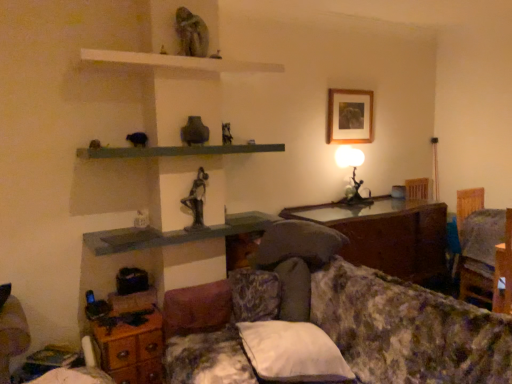
Question: From a real-world perspective, is wooden picture frame at upper center positioned over metallic silver table lamp at upper right based on gravity?

Choices:
 (A) no
 (B) yes

Answer: (B)

Question: Is wooden picture frame at upper center not within metallic silver table lamp at upper right?

Choices:
 (A) no
 (B) yes

Answer: (B)

Question: Is wooden picture frame at upper center behind metallic silver table lamp at upper right?

Choices:
 (A) no
 (B) yes

Answer: (B)

Question: Considering the relative positions of wooden picture frame at upper center and metallic silver table lamp at upper right in the image provided, is wooden picture frame at upper center to the right of metallic silver table lamp at upper right from the viewer's perspective?

Choices:
 (A) yes
 (B) no

Answer: (B)

Question: Is wooden picture frame at upper center facing away from metallic silver table lamp at upper right?

Choices:
 (A) no
 (B) yes

Answer: (A)

Question: From the image's perspective, is wooden picture frame at upper center located beneath metallic silver table lamp at upper right?

Choices:
 (A) no
 (B) yes

Answer: (A)

Question: From a real-world perspective, is green matte shelf at center, placed as the second shelf when sorted from top to bottom, on wooden dresser at lower left?

Choices:
 (A) no
 (B) yes

Answer: (B)

Question: From the image's perspective, is green matte shelf at center, placed as the second shelf when sorted from top to bottom, under wooden dresser at lower left?

Choices:
 (A) yes
 (B) no

Answer: (B)

Question: Is green matte shelf at center, acting as the second shelf starting from the bottom, further to the viewer compared to wooden dresser at lower left?

Choices:
 (A) no
 (B) yes

Answer: (A)

Question: Are green matte shelf at center, acting as the second shelf starting from the bottom, and wooden dresser at lower left beside each other?

Choices:
 (A) no
 (B) yes

Answer: (A)

Question: Is green matte shelf at center, acting as the second shelf starting from the bottom, looking in the opposite direction of wooden dresser at lower left?

Choices:
 (A) no
 (B) yes

Answer: (A)

Question: From a real-world perspective, does green matte shelf at center, acting as the second shelf starting from the bottom, sit lower than wooden dresser at lower left?

Choices:
 (A) no
 (B) yes

Answer: (A)

Question: Are bronze statue at center and matte gray shelf at center, positioned as the 1th shelf in bottom-to-top order, located far from each other?

Choices:
 (A) yes
 (B) no

Answer: (B)